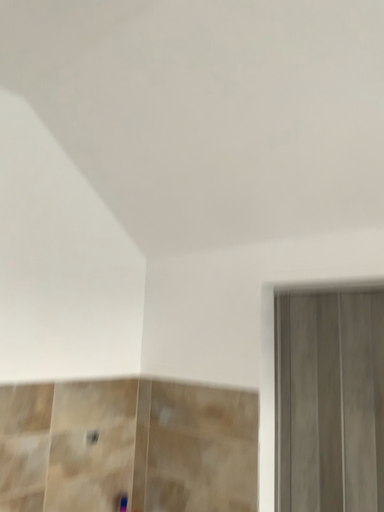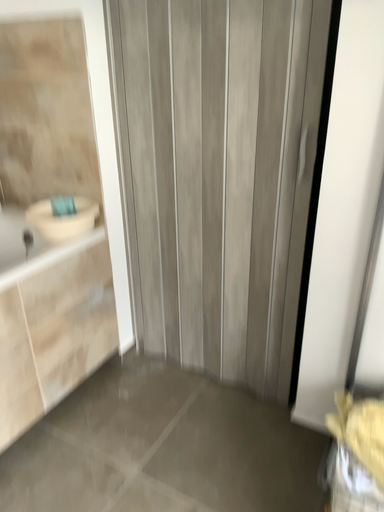
Question: How did the camera likely rotate when shooting the video?

Choices:
 (A) rotated right
 (B) rotated left

Answer: (A)